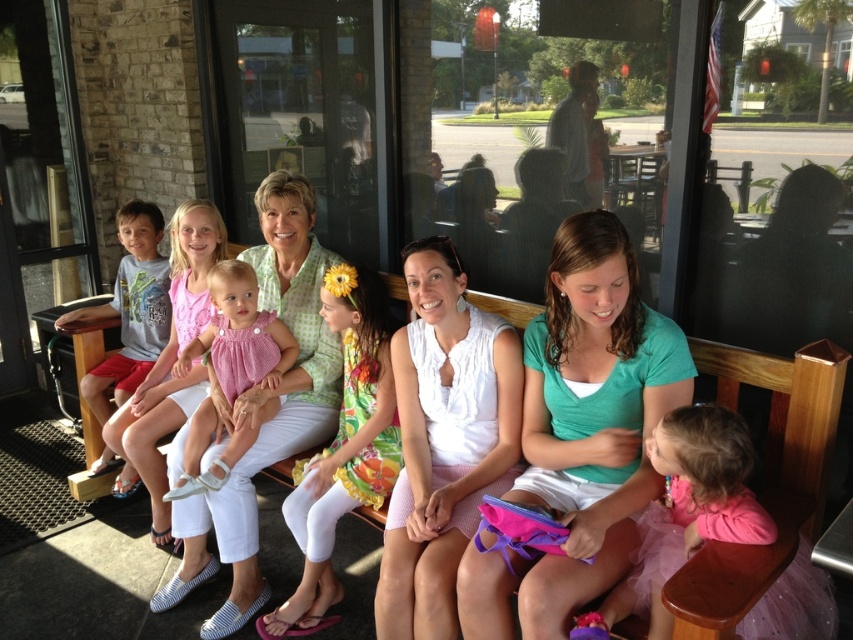
Question: Can you confirm if polka dot blouse at center is positioned to the right of floral dress at center?

Choices:
 (A) yes
 (B) no

Answer: (B)

Question: Can you confirm if polka dot blouse at center is wider than pink satin dress at center?

Choices:
 (A) no
 (B) yes

Answer: (B)

Question: Which object is farther from the camera taking this photo?

Choices:
 (A) pink tulle skirt at lower right
 (B) white fabric dress at center
 (C) green cotton shirt at center

Answer: (B)

Question: Is pink tulle skirt at lower right to the right of pink satin dress at center from the viewer's perspective?

Choices:
 (A) yes
 (B) no

Answer: (A)

Question: Which object is closer to the camera taking this photo?

Choices:
 (A) matte gray shirt at left
 (B) polka dot blouse at center

Answer: (B)

Question: Among these objects, which one is farthest from the camera?

Choices:
 (A) matte gray shirt at left
 (B) pink tulle skirt at lower right
 (C) green cotton shirt at center
 (D) floral dress at center

Answer: (A)